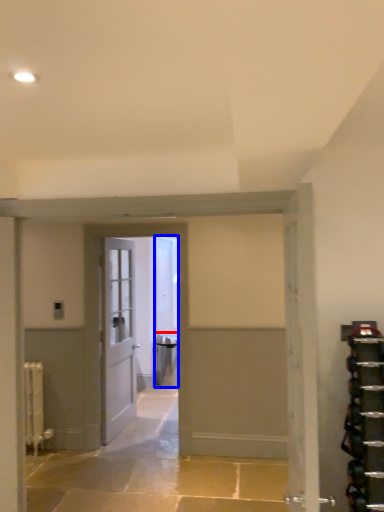
Question: Which of the following is the farthest to the observer, furniture (highlighted by a red box) or door (highlighted by a blue box)?

Choices:
 (A) furniture
 (B) door

Answer: (B)